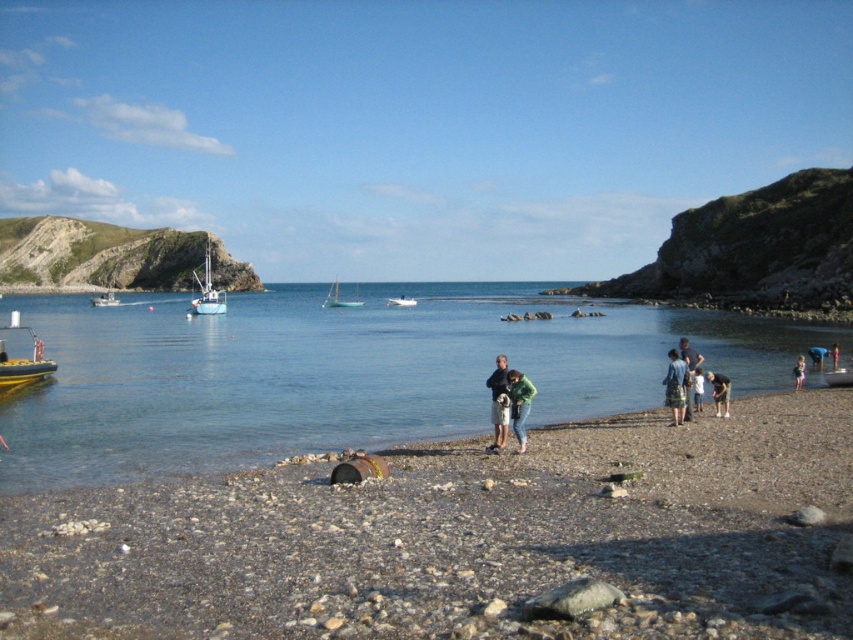
In the scene shown: Between yellow rubber boat at lower left and light brown fabric pants at lower right, which one is positioned lower?

light brown fabric pants at lower right is below.

Does yellow rubber boat at lower left have a lesser height compared to light brown fabric pants at lower right?

In fact, yellow rubber boat at lower left may be taller than light brown fabric pants at lower right.

Image resolution: width=853 pixels, height=640 pixels. I want to click on yellow rubber boat at lower left, so click(x=22, y=362).

Does clear blue water at center appear on the right side of yellow rubber boat at lower left?

Correct, you'll find clear blue water at center to the right of yellow rubber boat at lower left.

Does clear blue water at center appear over yellow rubber boat at lower left?

Yes.

Is point (397, 403) farther from camera compared to point (51, 369)?

That is False.

Where is `clear blue water at center`? The image size is (853, 640). clear blue water at center is located at coordinates (340, 372).

Can you confirm if blue denim jacket at center is wider than light brown fabric shirt at lower right?

No, blue denim jacket at center is not wider than light brown fabric shirt at lower right.

Does blue denim jacket at center have a greater height compared to light brown fabric shirt at lower right?

Yes.

In order to click on blue denim jacket at center in this screenshot , I will do `click(675, 387)`.

Identify the location of blue denim jacket at center. This screenshot has width=853, height=640. (675, 387).